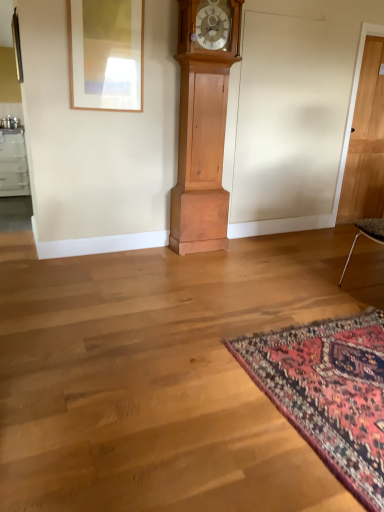
Describe the element at coordinates (366, 142) in the screenshot. I see `light brown wooden door at right` at that location.

Where is `light brown wood grandfather clock at center`? light brown wood grandfather clock at center is located at coordinates (203, 128).

The width and height of the screenshot is (384, 512). Identify the location of matte wooden picture frame at upper left. (106, 54).

Considering the relative sizes of light brown wooden door at right and light brown wood grandfather clock at center in the image provided, is light brown wooden door at right shorter than light brown wood grandfather clock at center?

Yes.

How many degrees apart are the facing directions of light brown wooden door at right and light brown wood grandfather clock at center?

The angle between the facing direction of light brown wooden door at right and the facing direction of light brown wood grandfather clock at center is 0.798 degrees.

In the image, is light brown wooden door at right positioned in front of or behind light brown wood grandfather clock at center?

In the image, light brown wooden door at right appears behind light brown wood grandfather clock at center.

This screenshot has width=384, height=512. What are the coordinates of `furniture in front of the light brown wooden door at right` in the screenshot? It's located at (203, 128).

Is light brown wooden door at right aimed at carpet with intricate patterns at lower right?

No, light brown wooden door at right does not turn towards carpet with intricate patterns at lower right.

Consider the image. From the image's perspective, which one is positioned lower, light brown wooden door at right or carpet with intricate patterns at lower right?

carpet with intricate patterns at lower right.

Does point (366, 198) come behind point (270, 390)?

Yes.

Are light brown wooden door at right and carpet with intricate patterns at lower right beside each other?

light brown wooden door at right and carpet with intricate patterns at lower right are not in contact.

Find the location of a particular element. This screenshot has height=512, width=384. mat located below the light brown wood grandfather clock at center (from the image's perspective) is located at coordinates tap(329, 392).

Could you tell me if carpet with intricate patterns at lower right is facing light brown wood grandfather clock at center?

No, carpet with intricate patterns at lower right does not turn towards light brown wood grandfather clock at center.

Between carpet with intricate patterns at lower right and light brown wood grandfather clock at center, which one has larger size?

light brown wood grandfather clock at center is bigger.

Do you think carpet with intricate patterns at lower right is within light brown wood grandfather clock at center, or outside of it?

The correct answer is: outside.

In the image, there is a light brown wood grandfather clock at center. At what (x,y) coordinates should I click in order to perform the action: click on picture frame above it (from the image's perspective). Please return your answer as a coordinate pair (x, y). This screenshot has height=512, width=384. Looking at the image, I should click on [x=106, y=54].

Is matte wooden picture frame at upper left facing away from light brown wood grandfather clock at center?

matte wooden picture frame at upper left does not have its back to light brown wood grandfather clock at center.

Does matte wooden picture frame at upper left appear on the right side of light brown wood grandfather clock at center?

No, matte wooden picture frame at upper left is not to the right of light brown wood grandfather clock at center.

Are matte wooden picture frame at upper left and light brown wood grandfather clock at center located far from each other?

No, matte wooden picture frame at upper left is not far away from light brown wood grandfather clock at center.

Measure the distance from carpet with intricate patterns at lower right to matte wooden picture frame at upper left.

The distance of carpet with intricate patterns at lower right from matte wooden picture frame at upper left is 7.74 feet.

Is carpet with intricate patterns at lower right in front of or behind matte wooden picture frame at upper left in the image?

Clearly, carpet with intricate patterns at lower right is in front of matte wooden picture frame at upper left.

From the picture: Does carpet with intricate patterns at lower right appear on the right side of matte wooden picture frame at upper left?

Indeed, carpet with intricate patterns at lower right is positioned on the right side of matte wooden picture frame at upper left.

Based on the photo, considering the sizes of objects carpet with intricate patterns at lower right and matte wooden picture frame at upper left in the image provided, who is wider, carpet with intricate patterns at lower right or matte wooden picture frame at upper left?

carpet with intricate patterns at lower right.

Considering the sizes of objects matte wooden picture frame at upper left and carpet with intricate patterns at lower right in the image provided, who is thinner, matte wooden picture frame at upper left or carpet with intricate patterns at lower right?

matte wooden picture frame at upper left.

From a real-world perspective, which is physically below, matte wooden picture frame at upper left or carpet with intricate patterns at lower right?

In real-world perspective, carpet with intricate patterns at lower right is lower.

Is matte wooden picture frame at upper left touching carpet with intricate patterns at lower right?

No.

From the image's perspective, relative to carpet with intricate patterns at lower right, is matte wooden picture frame at upper left above or below?

Based on their image positions, matte wooden picture frame at upper left is located above carpet with intricate patterns at lower right.

Does point (339, 200) come in front of point (76, 91)?

No, (339, 200) is behind (76, 91).

Identify the location of door below the matte wooden picture frame at upper left (from the image's perspective). Image resolution: width=384 pixels, height=512 pixels. (366, 142).

From a real-world perspective, which is physically above, light brown wooden door at right or matte wooden picture frame at upper left?

matte wooden picture frame at upper left.

Is light brown wooden door at right surrounding matte wooden picture frame at upper left?

No.

The image size is (384, 512). What are the coordinates of `furniture below the light brown wooden door at right (from the image's perspective)` in the screenshot? It's located at (203, 128).

At what (x,y) coordinates should I click in order to perform the action: click on mat in front of the light brown wooden door at right. Please return your answer as a coordinate pair (x, y). This screenshot has width=384, height=512. Looking at the image, I should click on (329, 392).

Based on their spatial positions, is matte wooden picture frame at upper left or light brown wood grandfather clock at center closer to carpet with intricate patterns at lower right?

Based on the image, light brown wood grandfather clock at center appears to be nearer to carpet with intricate patterns at lower right.

Based on their spatial positions, is light brown wood grandfather clock at center or light brown wooden door at right further from matte wooden picture frame at upper left?

light brown wooden door at right is positioned further to the anchor matte wooden picture frame at upper left.

Based on their spatial positions, is light brown wooden door at right or light brown wood grandfather clock at center further from matte wooden picture frame at upper left?

light brown wooden door at right is positioned further to the anchor matte wooden picture frame at upper left.

Based on their spatial positions, is carpet with intricate patterns at lower right or light brown wood grandfather clock at center further from light brown wooden door at right?

carpet with intricate patterns at lower right is further to light brown wooden door at right.

Based on their spatial positions, is light brown wood grandfather clock at center or carpet with intricate patterns at lower right closer to matte wooden picture frame at upper left?

light brown wood grandfather clock at center is positioned closer to the anchor matte wooden picture frame at upper left.

Which object lies further to the anchor point carpet with intricate patterns at lower right, matte wooden picture frame at upper left or light brown wooden door at right?

light brown wooden door at right is positioned further to the anchor carpet with intricate patterns at lower right.

Estimate the real-world distances between objects in this image. Which object is further from light brown wooden door at right, light brown wood grandfather clock at center or matte wooden picture frame at upper left?

matte wooden picture frame at upper left lies further to light brown wooden door at right than the other object.

From the image, which object appears to be farther from light brown wood grandfather clock at center, light brown wooden door at right or carpet with intricate patterns at lower right?

carpet with intricate patterns at lower right is positioned further to the anchor light brown wood grandfather clock at center.

You are a GUI agent. You are given a task and a screenshot of the screen. Output one action in this format:
    pyautogui.click(x=<x>, y=<y>)
    Task: Click on the furniture between carpet with intricate patterns at lower right and light brown wooden door at right from front to back
    
    Given the screenshot: What is the action you would take?
    pyautogui.click(x=203, y=128)

The height and width of the screenshot is (512, 384). I want to click on picture frame positioned between carpet with intricate patterns at lower right and light brown wooden door at right from near to far, so click(106, 54).

Identify the location of furniture that lies between matte wooden picture frame at upper left and carpet with intricate patterns at lower right from top to bottom. (203, 128).

The height and width of the screenshot is (512, 384). In order to click on furniture situated between matte wooden picture frame at upper left and light brown wooden door at right from left to right in this screenshot , I will do `click(203, 128)`.